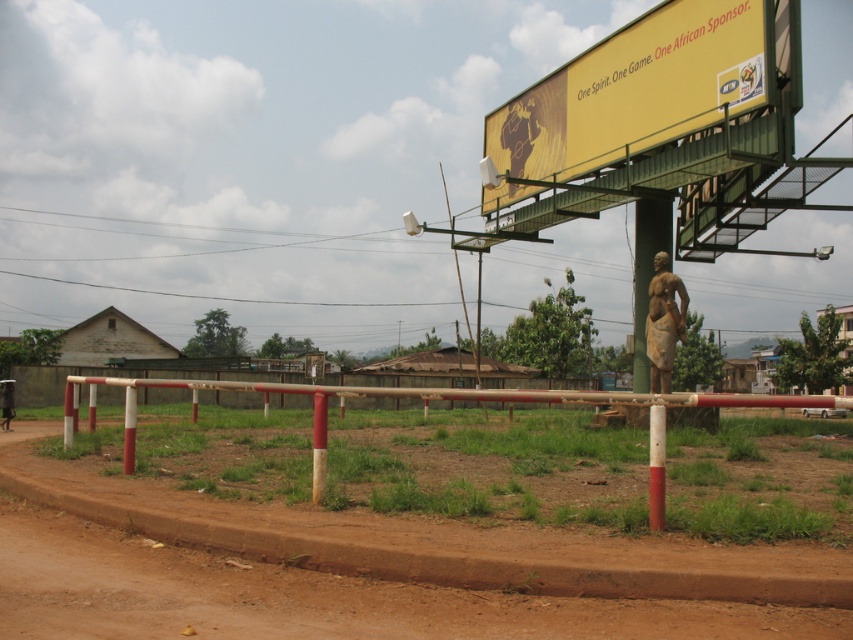
Who is positioned more to the left, white painted wood barrier at center or red matte pole at center?

Positioned to the left is white painted wood barrier at center.

Is white painted wood barrier at center bigger than red matte pole at center?

Correct, white painted wood barrier at center is larger in size than red matte pole at center.

Between point (717, 397) and point (660, 516), which one is positioned behind?

Positioned behind is point (717, 397).

Locate an element on the screen. This screenshot has height=640, width=853. white painted wood barrier at center is located at coordinates click(x=384, y=452).

Does brown dirt field at center appear over red matte pole at center?

No, brown dirt field at center is not above red matte pole at center.

Can you confirm if brown dirt field at center is wider than red matte pole at center?

Indeed, brown dirt field at center has a greater width compared to red matte pole at center.

Who is more forward, (814,612) or (657,426)?

Point (814,612) is in front.

Find the location of a particular element. brown dirt field at center is located at coordinates (309, 596).

Can you confirm if yellow matte billboard at upper right is positioned above bronze statue at center?

Indeed, yellow matte billboard at upper right is positioned over bronze statue at center.

The image size is (853, 640). I want to click on yellow matte billboard at upper right, so click(x=631, y=93).

At what (x,y) coordinates should I click in order to perform the action: click on yellow matte billboard at upper right. Please return your answer as a coordinate pair (x, y). This screenshot has width=853, height=640. Looking at the image, I should click on (631, 93).